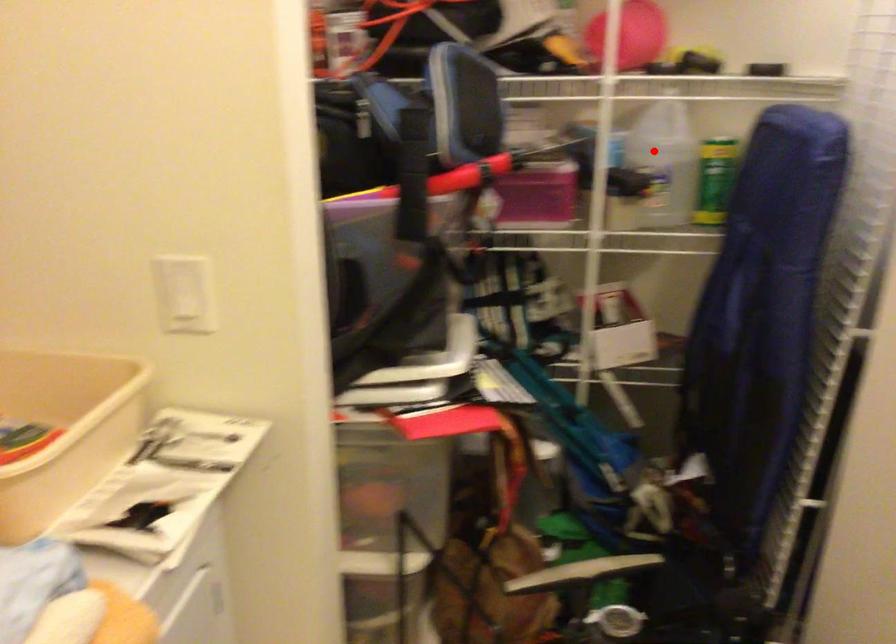
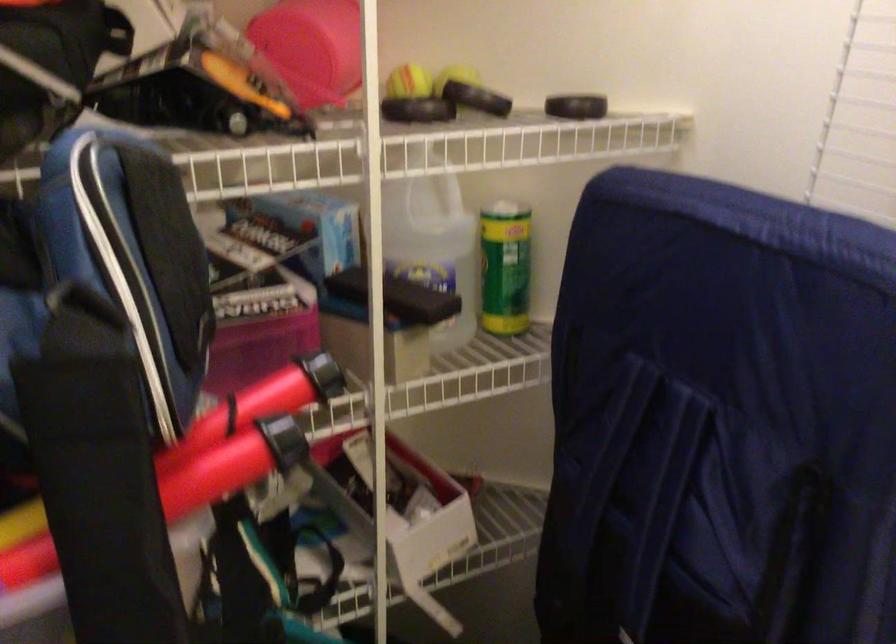
Where in the second image is the point corresponding to the highlighted location from the first image?

(433, 243)